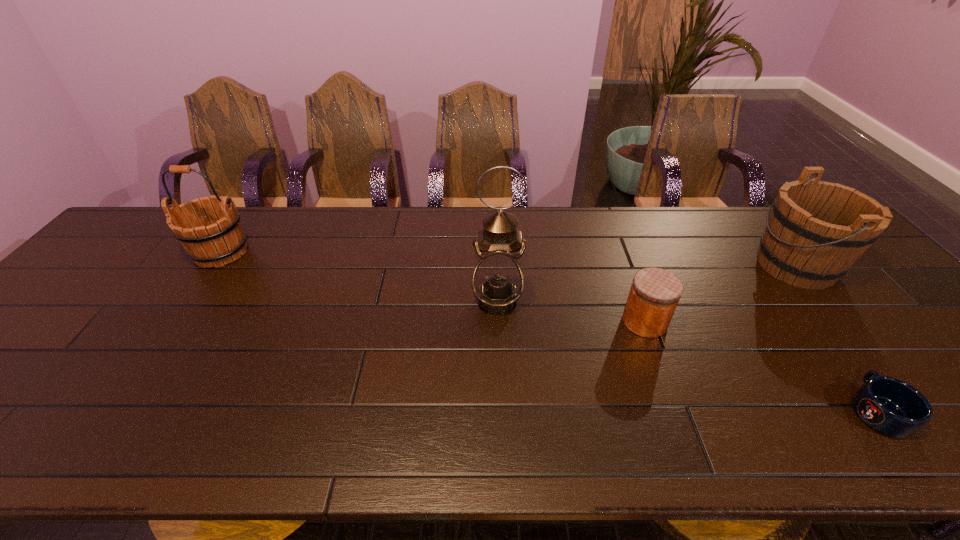
The image size is (960, 540). Identify the location of free space between the left wine bucket and the second shortest object. (433, 287).

Locate an element on the screen. The image size is (960, 540). vacant space that is in between the second shortest object and the shortest object is located at coordinates (761, 366).

Point out which object is positioned as the third nearest to the oil lamp. Please provide its 2D coordinates. Your answer should be formatted as a tuple, i.e. [(x, y)], where the tuple contains the x and y coordinates of a point satisfying the conditions above.

[(817, 230)]

Where is `object that can be found as the fourth closest to the nearest object`? The height and width of the screenshot is (540, 960). object that can be found as the fourth closest to the nearest object is located at coordinates (223, 241).